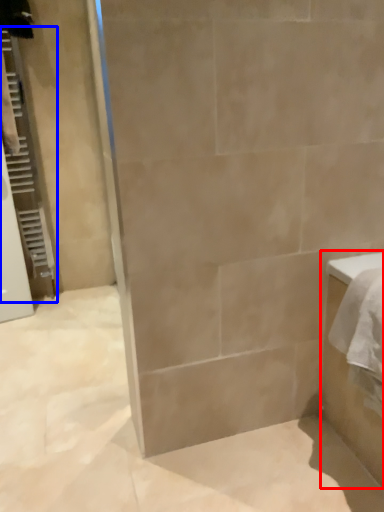
Question: Which point is closer to the camera, bathroom cabinet (highlighted by a red box) or screen door (highlighted by a blue box)?

Choices:
 (A) bathroom cabinet
 (B) screen door

Answer: (A)